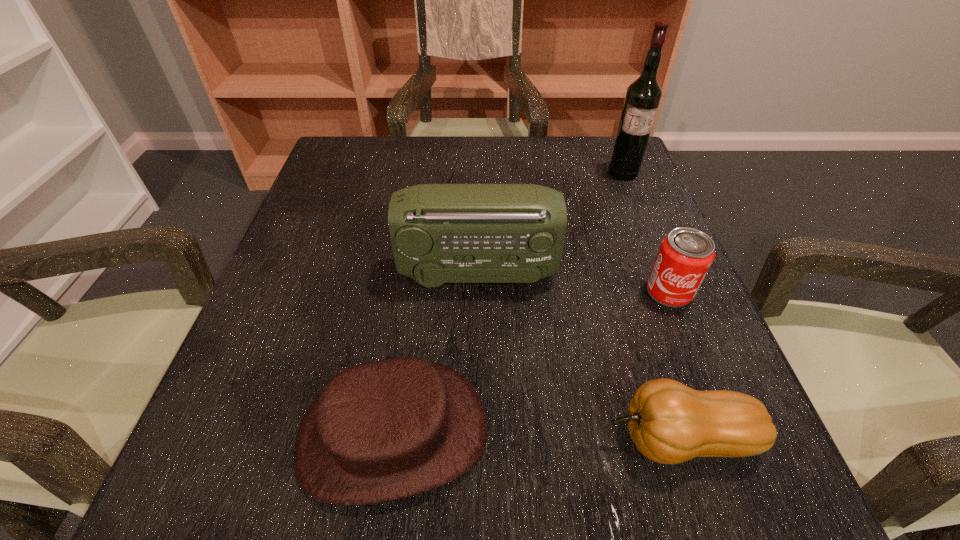
Image resolution: width=960 pixels, height=540 pixels. What are the coordinates of `object that is at the near left corner` in the screenshot? It's located at (384, 430).

In order to click on object positioned at the far right corner in this screenshot , I will do `click(643, 96)`.

The height and width of the screenshot is (540, 960). Identify the location of object that is at the near right corner. (670, 423).

You are a GUI agent. You are given a task and a screenshot of the screen. Output one action in this format:
    pyautogui.click(x=<x>, y=<y>)
    Task: Click on the blank area at the far edge
    
    Given the screenshot: What is the action you would take?
    pyautogui.click(x=442, y=182)

Where is `vacant space at the near edge`? vacant space at the near edge is located at coordinates (466, 515).

The height and width of the screenshot is (540, 960). In the image, there is a desktop. Identify the location of free space at the left edge. (264, 392).

In the image, there is a desktop. What are the coordinates of `free region at the right edge` in the screenshot? It's located at (695, 354).

Where is `vacant space at the far left corner`? Image resolution: width=960 pixels, height=540 pixels. vacant space at the far left corner is located at coordinates (362, 144).

This screenshot has width=960, height=540. What are the coordinates of `free spot at the far right corner of the desktop` in the screenshot? It's located at (647, 185).

Where is `vacant space in between the gourd and the hat`? This screenshot has height=540, width=960. vacant space in between the gourd and the hat is located at coordinates (537, 436).